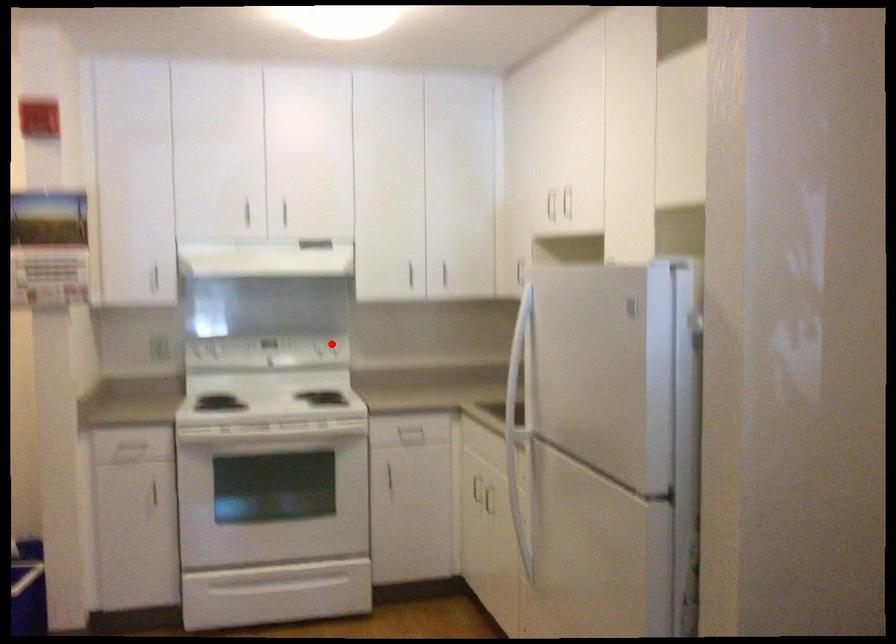
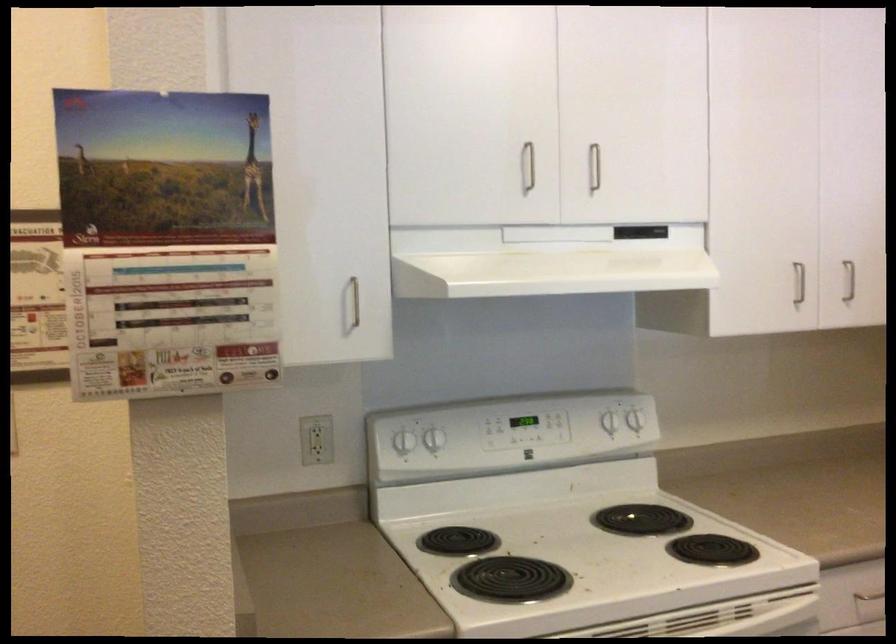
The point at the highlighted location is marked in the first image. Where is the corresponding point in the second image?

(634, 420)